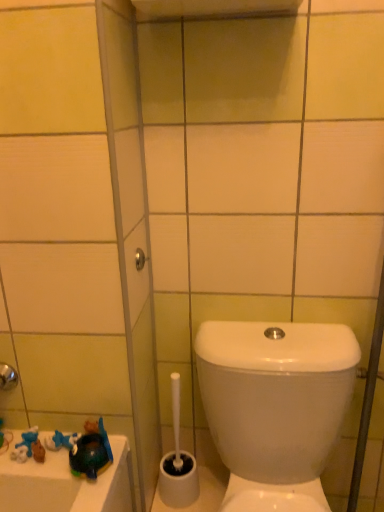
Question: Is shiny blue plastic toy at lower left not within white glossy toilet at lower right?

Choices:
 (A) yes
 (B) no

Answer: (A)

Question: Does shiny blue plastic toy at lower left appear on the left side of white glossy toilet at lower right?

Choices:
 (A) no
 (B) yes

Answer: (B)

Question: Is shiny blue plastic toy at lower left shorter than white glossy toilet at lower right?

Choices:
 (A) yes
 (B) no

Answer: (A)

Question: Considering the relative sizes of shiny blue plastic toy at lower left and white glossy toilet at lower right in the image provided, is shiny blue plastic toy at lower left bigger than white glossy toilet at lower right?

Choices:
 (A) no
 (B) yes

Answer: (A)

Question: Is shiny blue plastic toy at lower left placed right next to white glossy toilet at lower right?

Choices:
 (A) no
 (B) yes

Answer: (A)

Question: Based on their positions, is matte silver showerhead at upper center located to the left or right of white glossy toilet at lower right?

Choices:
 (A) left
 (B) right

Answer: (A)

Question: In the image, is matte silver showerhead at upper center positioned in front of or behind white glossy toilet at lower right?

Choices:
 (A) behind
 (B) front

Answer: (A)

Question: Is matte silver showerhead at upper center spatially inside white glossy toilet at lower right, or outside of it?

Choices:
 (A) inside
 (B) outside

Answer: (B)

Question: From a real-world perspective, is matte silver showerhead at upper center above or below white glossy toilet at lower right?

Choices:
 (A) above
 (B) below

Answer: (A)

Question: Is white glossy toilet at lower right situated inside white plastic toilet brush at lower center or outside?

Choices:
 (A) inside
 (B) outside

Answer: (B)

Question: Is white glossy toilet at lower right to the left or to the right of white plastic toilet brush at lower center in the image?

Choices:
 (A) left
 (B) right

Answer: (B)

Question: Looking at their shapes, would you say white glossy toilet at lower right is wider or thinner than white plastic toilet brush at lower center?

Choices:
 (A) wide
 (B) thin

Answer: (A)

Question: Is point (221, 444) positioned closer to the camera than point (182, 455)?

Choices:
 (A) farther
 (B) closer

Answer: (B)

Question: Considering their positions, is shiny blue plastic toy at lower left located in front of or behind white plastic toilet brush at lower center?

Choices:
 (A) front
 (B) behind

Answer: (A)

Question: From a real-world perspective, is shiny blue plastic toy at lower left positioned above or below white plastic toilet brush at lower center?

Choices:
 (A) above
 (B) below

Answer: (A)